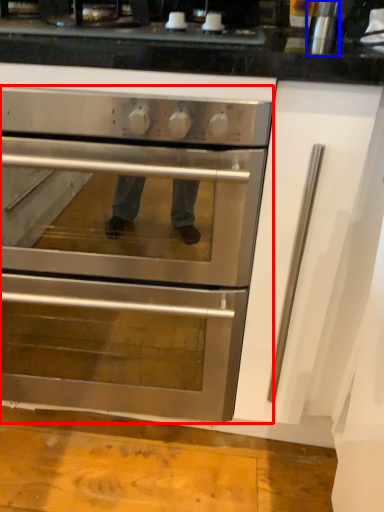
Question: Which point is further to the camera, oven (highlighted by a red box) or appliance (highlighted by a blue box)?

Choices:
 (A) oven
 (B) appliance

Answer: (B)